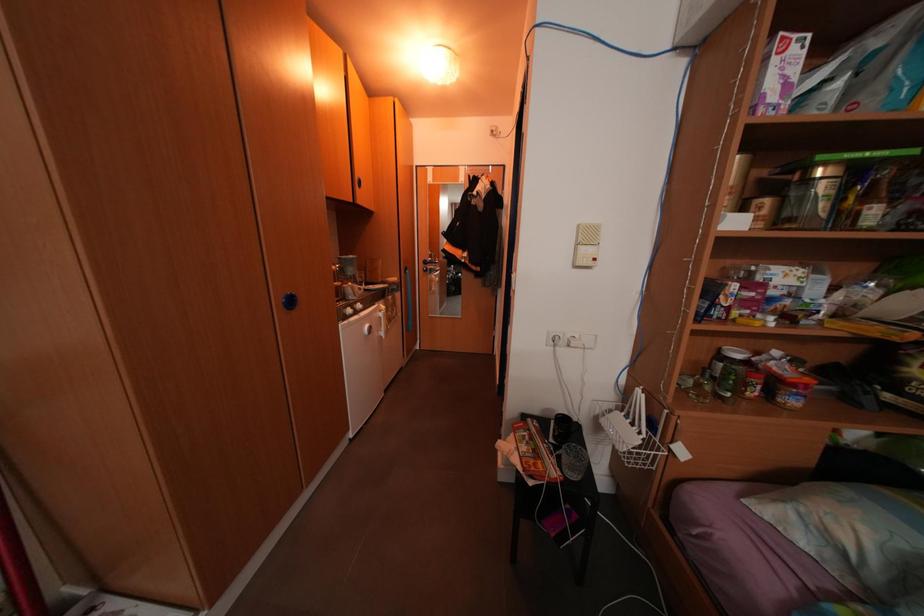
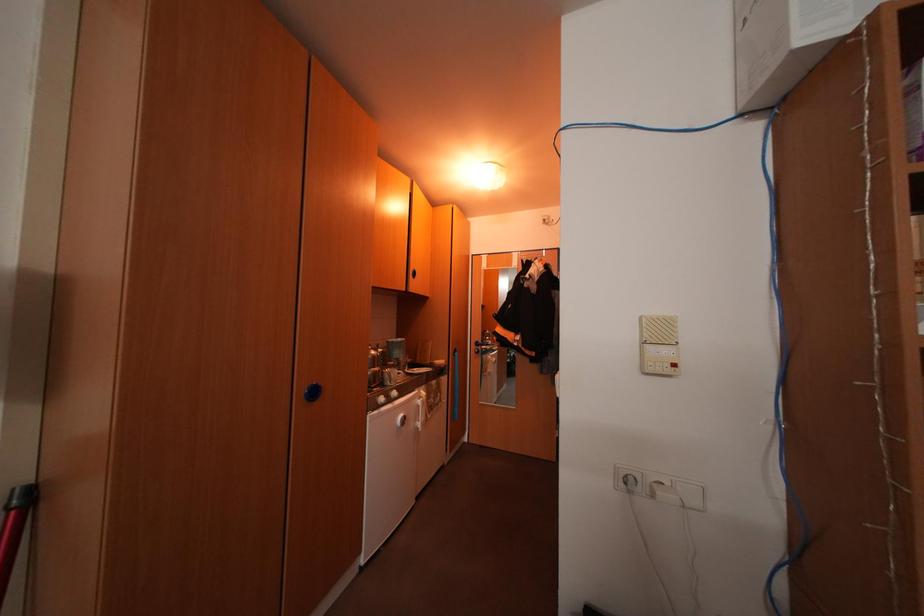
Which direction would the cameraman need to move to produce the second image?

The movement direction of the cameraman is right, forward.